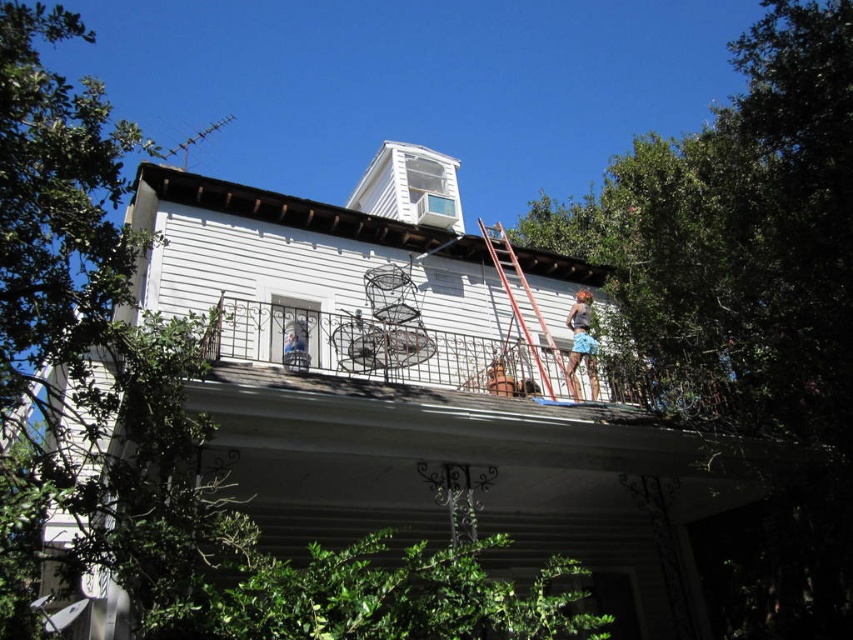
Measure the distance between point (502, 285) and camera.

Point (502, 285) and camera are 21.99 meters apart from each other.

Who is more forward, [546,346] or [492,376]?

Point [492,376]

This screenshot has height=640, width=853. Identify the location of rustic wood ladder at upper center. (525, 310).

Between blue fabric shorts at upper right and brown leather bag at center, which one is positioned higher?

blue fabric shorts at upper right is above.

Which is below, blue fabric shorts at upper right or brown leather bag at center?

brown leather bag at center is lower down.

Who is more forward, (590, 304) or (515, 388)?

Positioned in front is point (515, 388).

Find the location of `blue fabric shorts at upper right`. blue fabric shorts at upper right is located at coordinates (581, 344).

Does rustic wood ladder at upper center have a greater width compared to blue fabric shorts at upper right?

Correct, the width of rustic wood ladder at upper center exceeds that of blue fabric shorts at upper right.

Is the position of rustic wood ladder at upper center more distant than that of blue fabric shorts at upper right?

No, it is not.

Does point (548, 381) lie in front of point (575, 320)?

Yes, it is in front of point (575, 320).

Find the location of a particular element. The image size is (853, 640). rustic wood ladder at upper center is located at coordinates (525, 310).